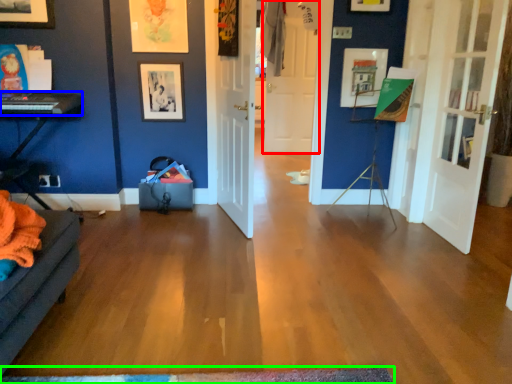
Question: Estimate the real-world distances between objects in this image. Which object is closer to door (highlighted by a red box), piano (highlighted by a blue box) or doormat (highlighted by a green box)?

Choices:
 (A) piano
 (B) doormat

Answer: (A)